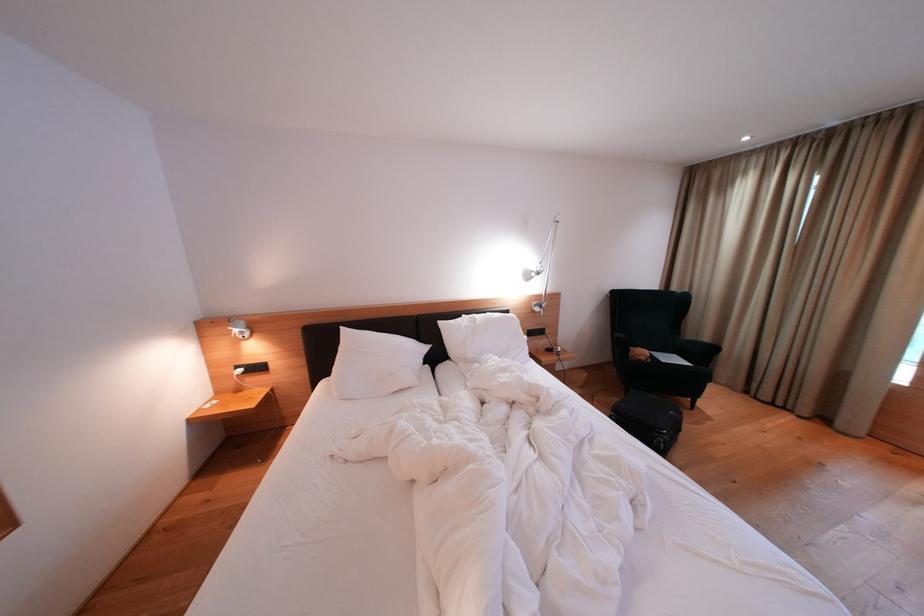
Image resolution: width=924 pixels, height=616 pixels. Identify the location of chair sitting surface. (690, 351).